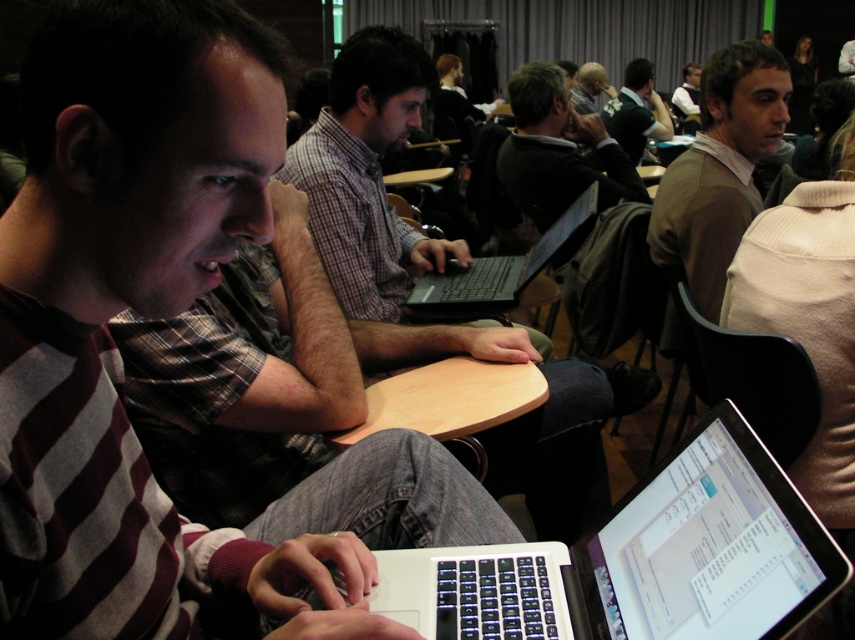
You are standing in the conference room and want to take a photo of the point at coordinates [470,396]. The camera you have can only focus on objects within 1.5 meters. Will the point be in focus?

The point at coordinates [470,396] is 1.39 meters from the camera, which is within the 1.5 meter focus range. Therefore, the point will be in focus.